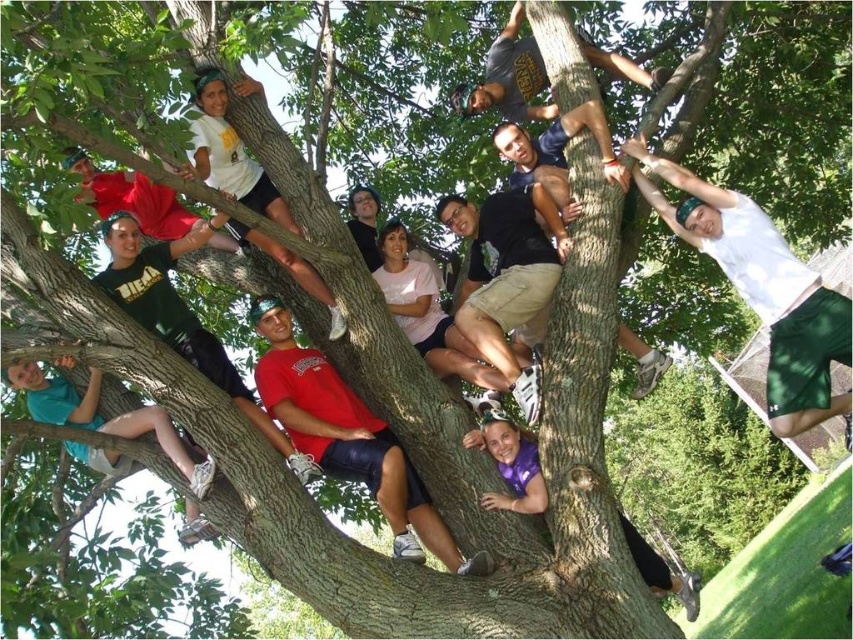
Does white matte shorts at upper right lie in front of teal matte shorts at lower left?

No.

Describe the element at coordinates (761, 289) in the screenshot. The width and height of the screenshot is (853, 640). I see `white matte shorts at upper right` at that location.

Which is in front, point (763, 307) or point (73, 420)?

Point (73, 420)

At what (x,y) coordinates should I click in order to perform the action: click on white matte shorts at upper right. Please return your answer as a coordinate pair (x, y). The height and width of the screenshot is (640, 853). Looking at the image, I should click on (761, 289).